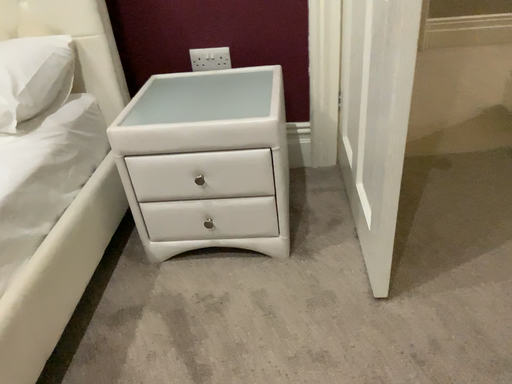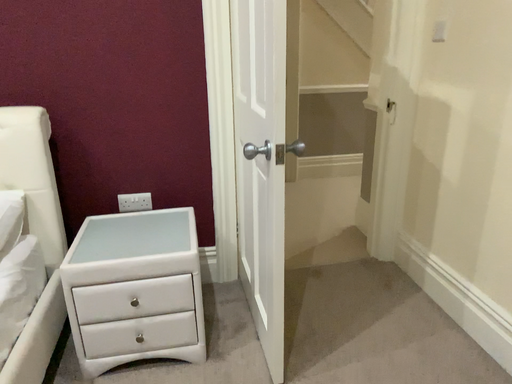
Question: How did the camera likely rotate when shooting the video?

Choices:
 (A) rotated upward
 (B) rotated downward

Answer: (A)